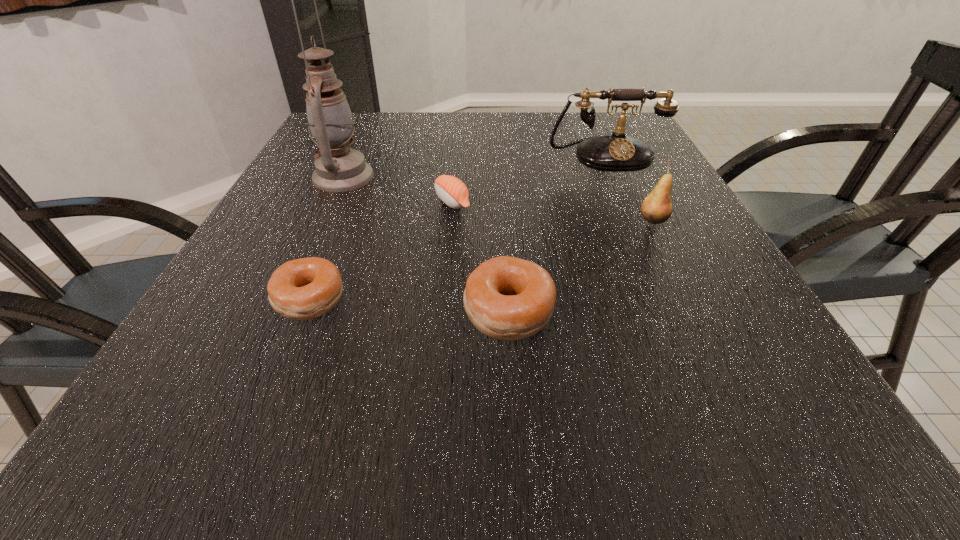
Find the location of `unoccupied position between the tallest object and the sushi`. unoccupied position between the tallest object and the sushi is located at coordinates (397, 189).

Find the location of a particular element. This screenshot has height=540, width=960. blank region between the pear and the sushi is located at coordinates (553, 211).

Identify the location of vacant space in between the pear and the telephone. The image size is (960, 540). (629, 188).

This screenshot has height=540, width=960. I want to click on vacant space that's between the sushi and the shorter bagel, so click(381, 251).

This screenshot has width=960, height=540. I want to click on free space that is in between the tallest object and the shorter bagel, so click(x=326, y=238).

Choose which object is the third nearest neighbor to the pear. Please provide its 2D coordinates. Your answer should be formatted as a tuple, i.e. [(x, y)], where the tuple contains the x and y coordinates of a point satisfying the conditions above.

[(452, 191)]

What are the coordinates of `the fourth closest object to the fourth shortest object` in the screenshot? It's located at (303, 289).

Where is `vacant space that satisfies the following two spatial constraints: 1. on the front side of the right bagel; 2. on the right side of the sushi`? vacant space that satisfies the following two spatial constraints: 1. on the front side of the right bagel; 2. on the right side of the sushi is located at coordinates (443, 312).

Identify the location of free spot that satisfies the following two spatial constraints: 1. on the dial of the telephone; 2. on the right side of the third tallest object. (634, 220).